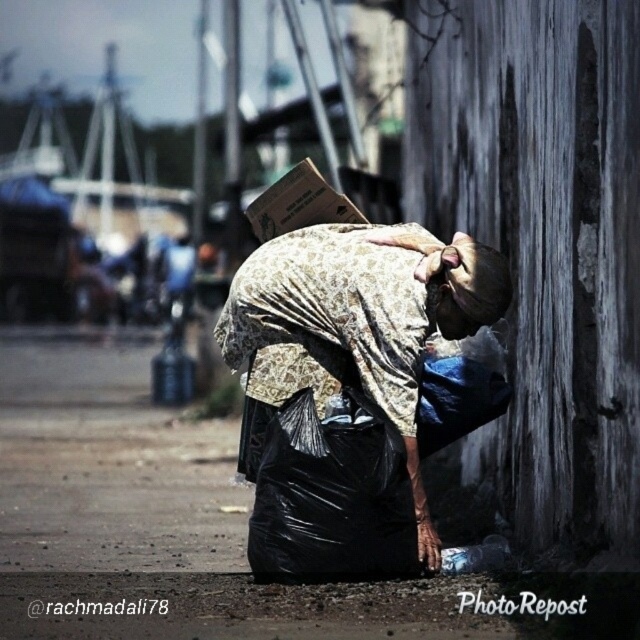
Who is shorter, brown woven hat at center or brown cardboard box at center?

brown woven hat at center is shorter.

What do you see at coordinates (468, 275) in the screenshot? The width and height of the screenshot is (640, 640). I see `brown woven hat at center` at bounding box center [468, 275].

Identify the location of brown woven hat at center. Image resolution: width=640 pixels, height=640 pixels. (468, 275).

Can you confirm if printed fabric bag at lower center is positioned to the left of brown woven hat at center?

Indeed, printed fabric bag at lower center is positioned on the left side of brown woven hat at center.

Can you confirm if printed fabric bag at lower center is positioned to the right of brown woven hat at center?

In fact, printed fabric bag at lower center is to the left of brown woven hat at center.

Is point (484, 268) behind point (497, 292)?

That is False.

The image size is (640, 640). What are the coordinates of `printed fabric bag at lower center` in the screenshot? It's located at (358, 320).

Does printed fabric bag at lower center have a greater height compared to brown cardboard box at center?

Incorrect, printed fabric bag at lower center's height is not larger of brown cardboard box at center's.

This screenshot has height=640, width=640. What do you see at coordinates (358, 320) in the screenshot?
I see `printed fabric bag at lower center` at bounding box center [358, 320].

The height and width of the screenshot is (640, 640). In order to click on printed fabric bag at lower center in this screenshot , I will do `click(358, 320)`.